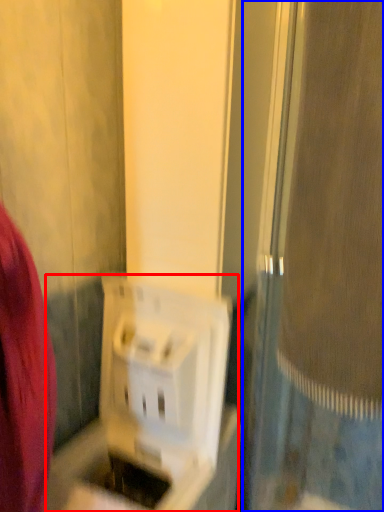
Question: Which object is further to the camera taking this photo, appliance (highlighted by a red box) or screen door (highlighted by a blue box)?

Choices:
 (A) appliance
 (B) screen door

Answer: (A)